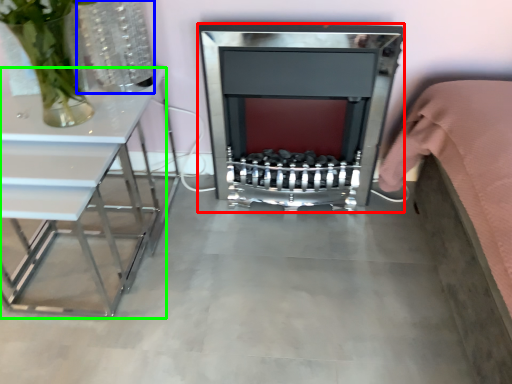
Question: Estimate the real-world distances between objects in this image. Which object is closer to fireplace (highlighted by a red box), vase (highlighted by a blue box) or table (highlighted by a green box)?

Choices:
 (A) vase
 (B) table

Answer: (A)